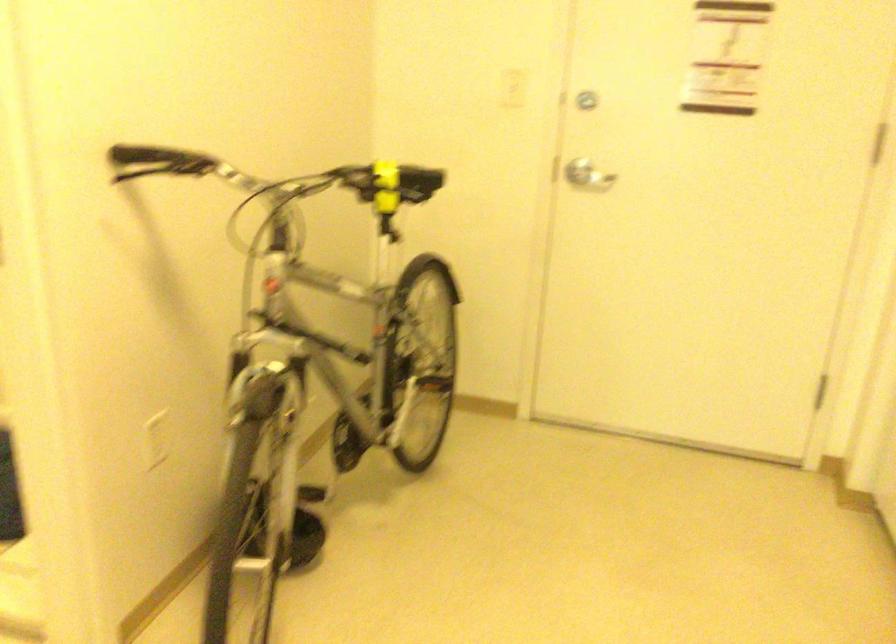
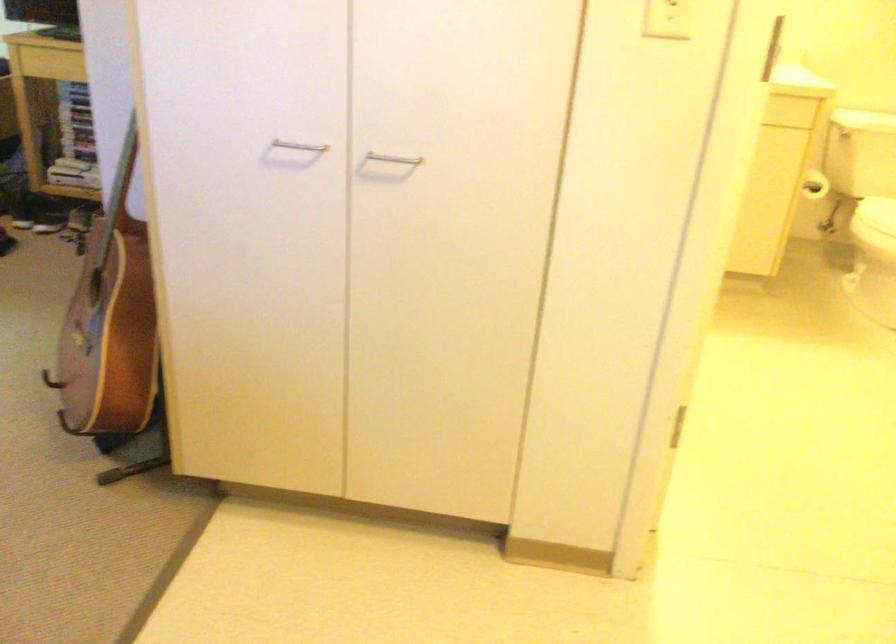
First-person continuous shooting, in which direction is the camera rotating?

The camera's rotation is toward left-down.